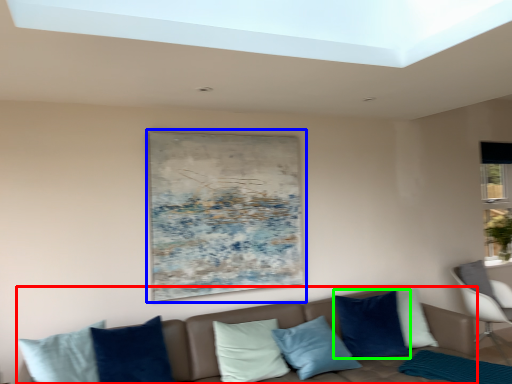
Question: Estimate the real-world distances between objects in this image. Which object is farther from studio couch (highlighted by a red box), picture frame (highlighted by a blue box) or pillow (highlighted by a green box)?

Choices:
 (A) picture frame
 (B) pillow

Answer: (A)